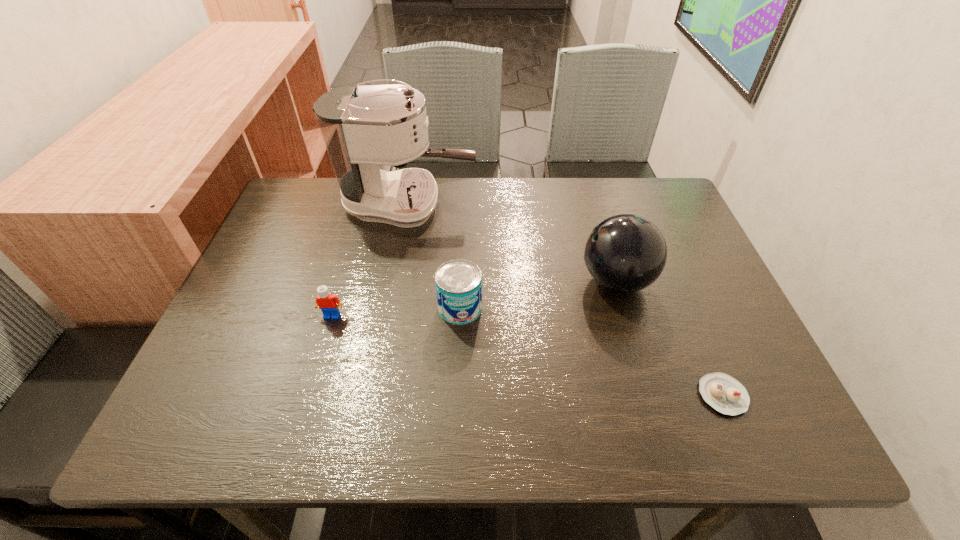
This screenshot has width=960, height=540. In order to click on free spot between the rightmost object and the fourth object from left to right in this screenshot , I will do `click(669, 338)`.

You are a GUI agent. You are given a task and a screenshot of the screen. Output one action in this format:
    pyautogui.click(x=<x>, y=<y>)
    Task: Click on the free spot between the shortest object and the tallest object
    The width and height of the screenshot is (960, 540).
    Given the screenshot: What is the action you would take?
    pyautogui.click(x=565, y=300)

The width and height of the screenshot is (960, 540). Find the location of `free spot between the nearest object and the bowling ball`. free spot between the nearest object and the bowling ball is located at coordinates (669, 338).

Identify the location of empty space that is in between the can and the Lego. (396, 312).

You are a GUI agent. You are given a task and a screenshot of the screen. Output one action in this format:
    pyautogui.click(x=<x>, y=<y>)
    Task: Click on the free spot between the tallest object and the bowling ball
    Image resolution: width=960 pixels, height=540 pixels.
    Given the screenshot: What is the action you would take?
    pyautogui.click(x=513, y=242)

The image size is (960, 540). Identify the location of object that stands as the second closest to the Lego. (364, 128).

Find the location of a particular element. object that stands as the second closest to the coffee maker is located at coordinates (625, 253).

I want to click on vacant region that satisfies the following two spatial constraints: 1. on the face of the cupcake; 2. on the right side of the Lego, so click(308, 395).

Locate an element on the screen. The width and height of the screenshot is (960, 540). free space that satisfies the following two spatial constraints: 1. on the face of the nearest object; 2. on the left side of the Lego is located at coordinates (308, 395).

Locate an element on the screen. This screenshot has height=540, width=960. free location that satisfies the following two spatial constraints: 1. on the back side of the shortest object; 2. on the side of the bowling ball with the finger holes is located at coordinates (674, 281).